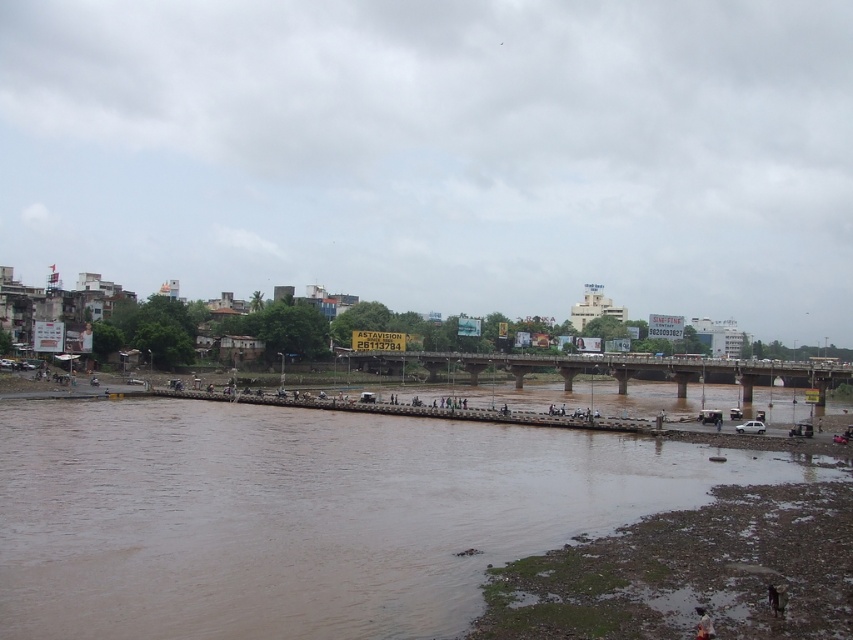
Question: Considering the relative positions of muddy sand at lower right and concrete bridge at center in the image provided, where is muddy sand at lower right located with respect to concrete bridge at center?

Choices:
 (A) below
 (B) above

Answer: (A)

Question: Does muddy sand at lower right appear on the left side of concrete bridge at center?

Choices:
 (A) yes
 (B) no

Answer: (A)

Question: Does muddy sand at lower right lie behind concrete bridge at center?

Choices:
 (A) yes
 (B) no

Answer: (B)

Question: Which object is farther from the camera taking this photo?

Choices:
 (A) concrete bridge at center
 (B) muddy sand at lower right

Answer: (A)

Question: Which of these objects is positioned farthest from the brown muddy water at lower left?

Choices:
 (A) concrete bridge at center
 (B) muddy sand at lower right

Answer: (A)

Question: Which of the following is the closest to the observer?

Choices:
 (A) (x=590, y=621)
 (B) (x=573, y=440)
 (C) (x=822, y=381)

Answer: (A)